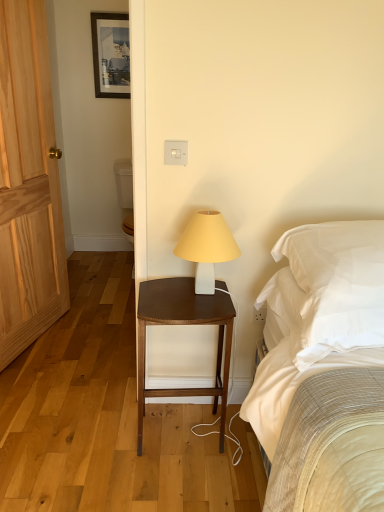
This screenshot has width=384, height=512. Find the location of `vacant area situated to the left side of brown wood nightstand at center`. vacant area situated to the left side of brown wood nightstand at center is located at coordinates (107, 443).